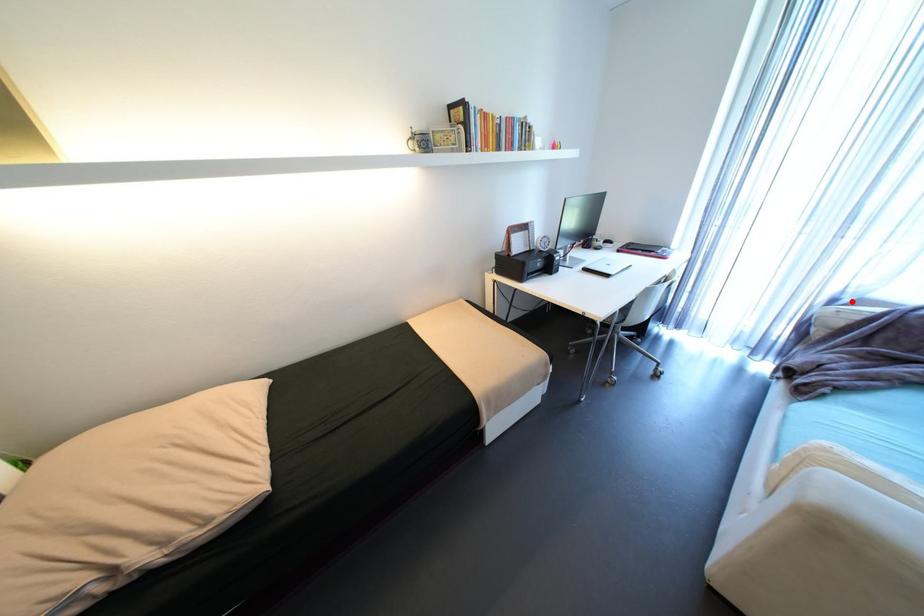
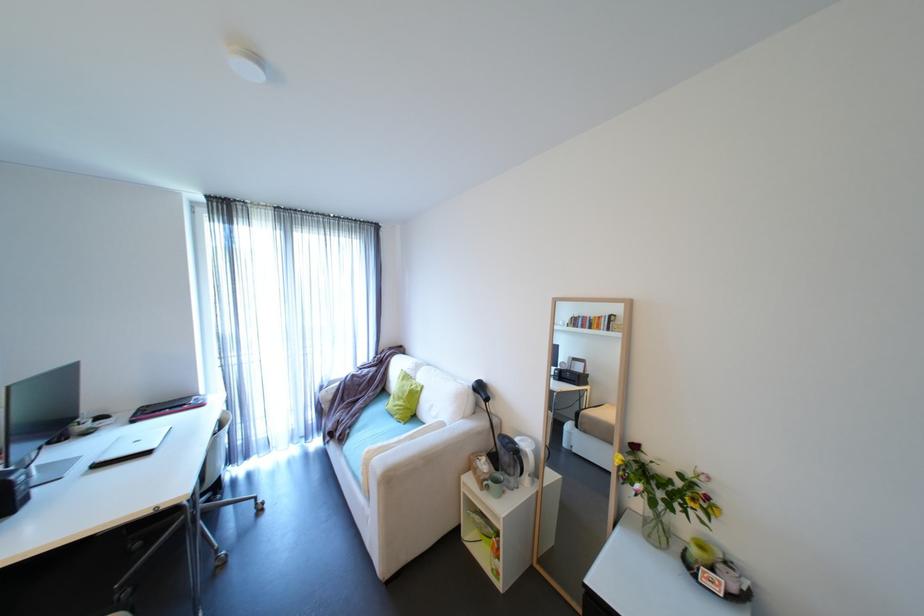
Question: I am providing you with two images of the same scene from different viewpoints. A red point is marked on the first image. Is the red point's position out of view in image 2?

Choices:
 (A) Yes
 (B) No

Answer: (B)